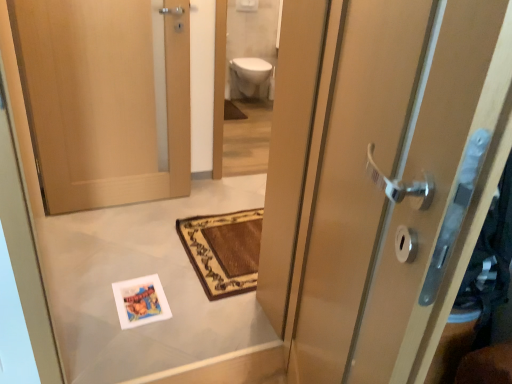
Question: Based on their sizes in the image, would you say brown woven bath mat at center is bigger or smaller than wooden door at left, the 1th door from the back?

Choices:
 (A) small
 (B) big

Answer: (A)

Question: Considering the positions of brown woven bath mat at center and wooden door at left, which is the 2th door from right to left, in the image, is brown woven bath mat at center wider or thinner than wooden door at left, which is the 2th door from right to left,?

Choices:
 (A) wide
 (B) thin

Answer: (A)

Question: Which is farther from the matte wood door at right, the 1th door when ordered from front to back?

Choices:
 (A) white glossy toilet bowl at upper center
 (B) brown woven bath mat at center
 (C) wooden door at left, the 1th door from the back
 (D) white glossy toilet at upper center

Answer: (A)

Question: Which of these objects is positioned closest to the brown woven bath mat at center?

Choices:
 (A) white glossy toilet bowl at upper center
 (B) wooden door at left, which is the 2th door from right to left
 (C) white glossy toilet at upper center
 (D) matte wood door at right, the first door from the right

Answer: (A)